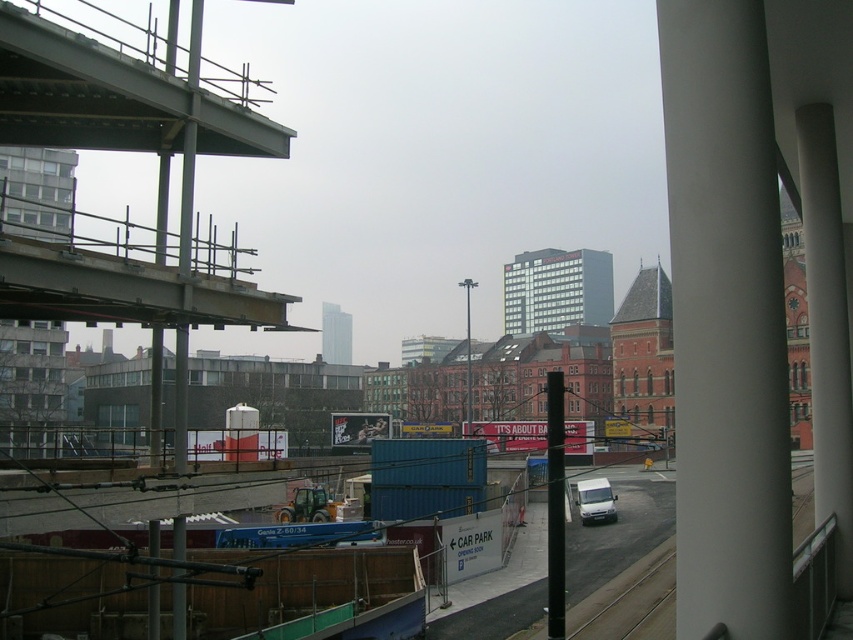
You are a delivery driver who needs to exit the construction site through the gray metallic overpass at upper left. Currently, you are driving your truck behind the white matte van at center. Can you safely move to the left to reach the overpass?

The gray metallic overpass at upper left is to the left of the white matte van at center, so you can safely move left to reach the overpass.

You are a delivery driver who needs to park your van in the CAR PARK near the construction site. Your van is 5 meters long. The gray metallic overpass at upper left is part of the parking structure. Can you safely park your white matte van at center there without hitting the overpass?

The distance between the gray metallic overpass at upper left and the white matte van at center is 51.72 meters. Since your van is only 5 meters long, there is sufficient space to park without hitting the overpass.

You are a delivery driver who needs to park your white matte van at center near the gray concrete train track at lower center. Can you safely drive the van onto the train track?

The gray concrete train track at lower center is above the white matte van at center, so the van cannot drive onto the train track as it is elevated and likely not designed for vehicle parking.